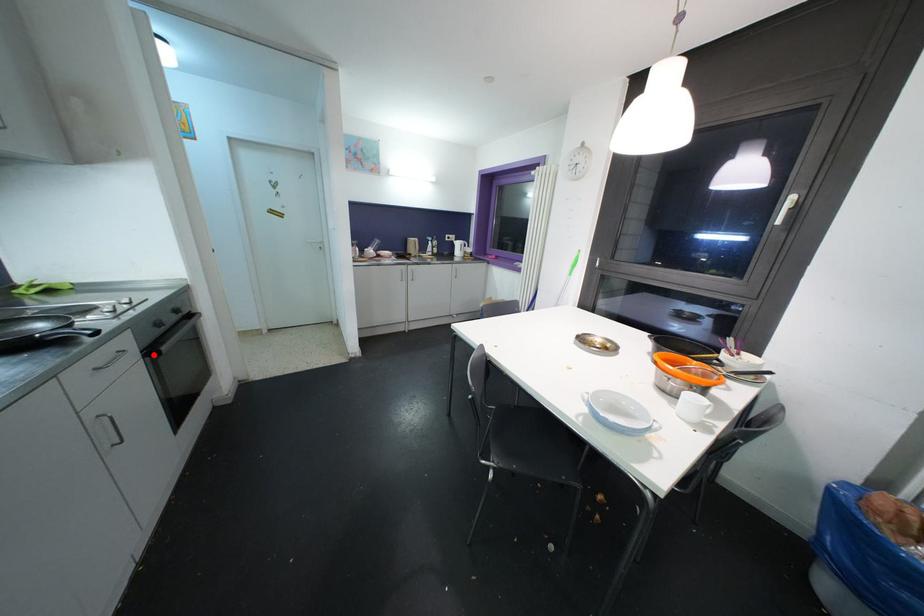
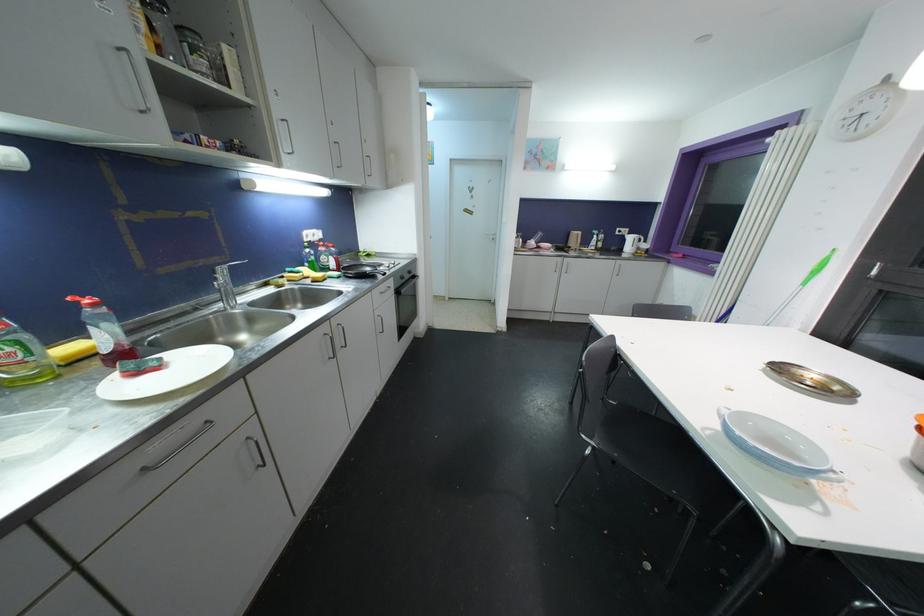
Find the pixel in the second image that matches the highlighted location in the first image.

(400, 294)